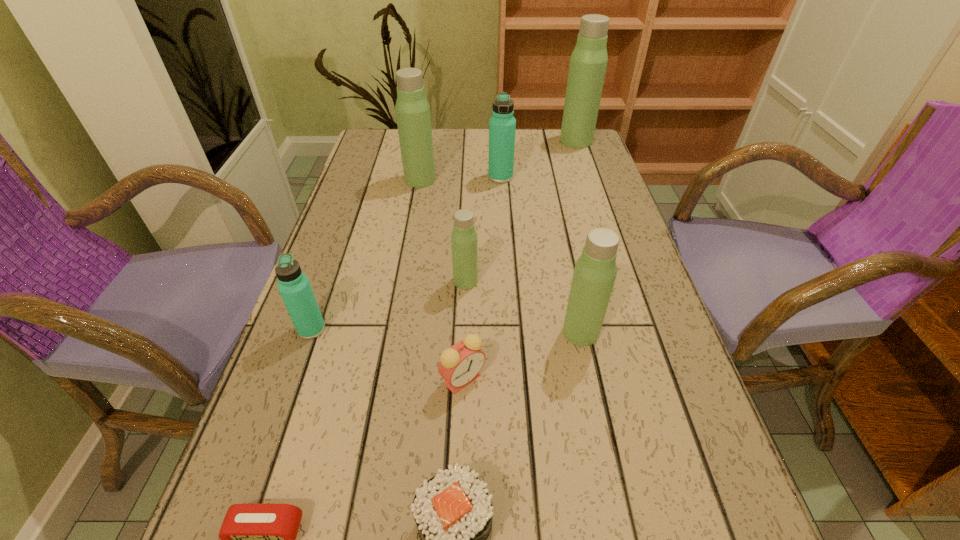
Identify the location of the rightmost light thermos bottle. (588, 62).

Find the location of a particular element. the farthest light thermos bottle is located at coordinates (588, 62).

This screenshot has height=540, width=960. I want to click on the second thermos bottle from left to right, so click(412, 108).

Where is `the second biggest light thermos bottle`? the second biggest light thermos bottle is located at coordinates (412, 108).

Where is `the right aqua thermos bottle`? The width and height of the screenshot is (960, 540). the right aqua thermos bottle is located at coordinates (502, 125).

Identify the location of the bigger aqua thermos bottle. The image size is (960, 540). point(502,125).

Locate an element on the screen. the second thermos bottle from right to left is located at coordinates (595, 271).

Find the location of `the second object from right to left`. the second object from right to left is located at coordinates (595, 271).

This screenshot has width=960, height=540. What are the coordinates of `the fourth thermos bottle from right to left` in the screenshot? It's located at (464, 236).

Where is `the second light thermos bottle from left to right`? the second light thermos bottle from left to right is located at coordinates (464, 236).